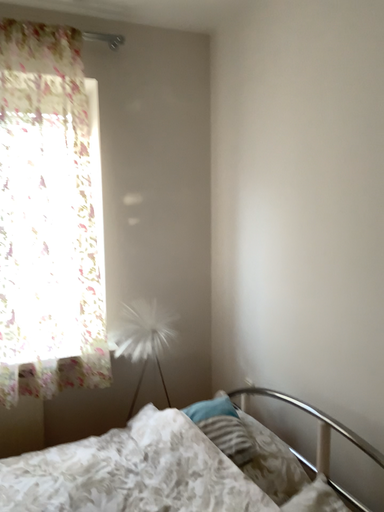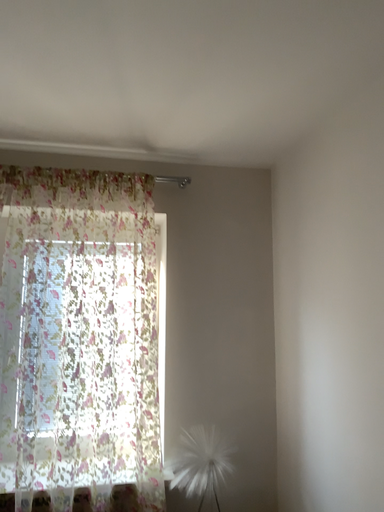
Question: Which way did the camera rotate in the video?

Choices:
 (A) rotated right
 (B) rotated left

Answer: (B)